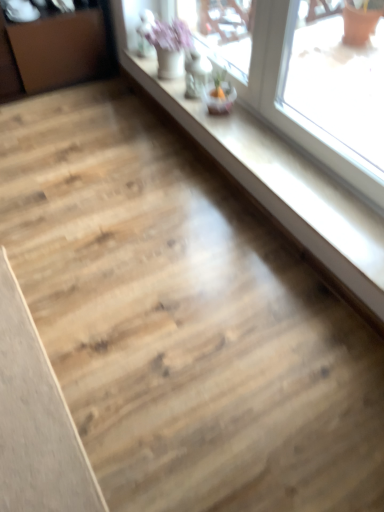
I want to click on vacant area on top of transparent glass window at upper right (from a real-world perspective), so click(x=272, y=157).